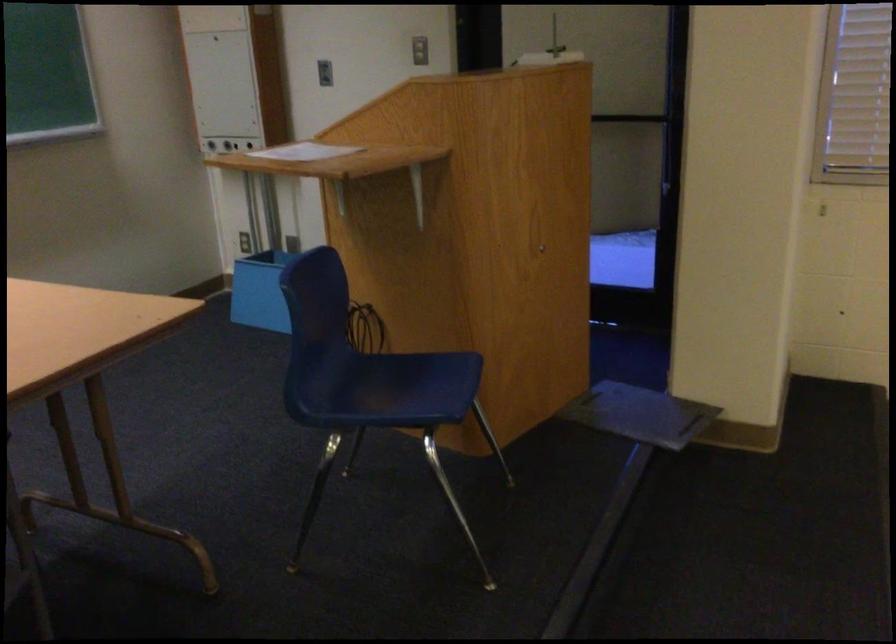
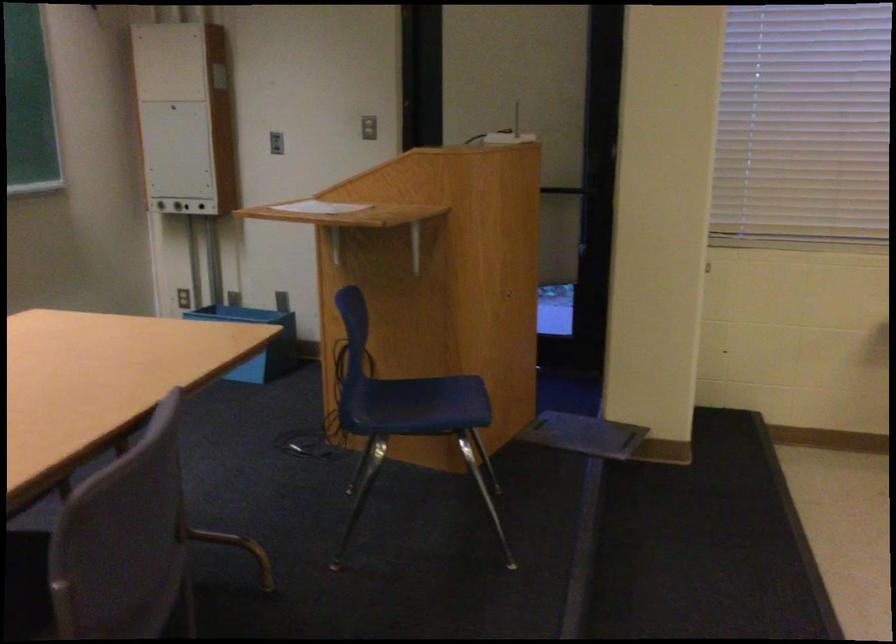
Question: The images are taken continuously from a first-person perspective. In which direction is your viewpoint rotating?

Choices:
 (A) Left
 (B) Right
 (C) Up
 (D) Down

Answer: (B)